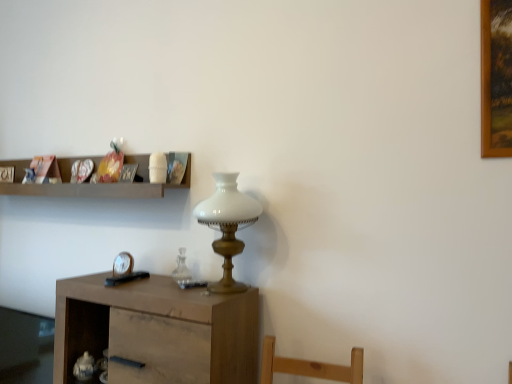
At what (x,y) coordinates should I click in order to perform the action: click on wooden cabinet at center. Please return your answer as a coordinate pair (x, y). Looking at the image, I should click on (157, 330).

Image resolution: width=512 pixels, height=384 pixels. What do you see at coordinates (157, 330) in the screenshot?
I see `wooden cabinet at center` at bounding box center [157, 330].

Measure the distance between point (x=49, y=359) and camera.

Point (x=49, y=359) is 2.03 meters away from camera.

What do you see at coordinates (25, 347) in the screenshot? I see `transparent glass cabinet at lower left` at bounding box center [25, 347].

Where is `wooden shelf at upper center`? wooden shelf at upper center is located at coordinates (91, 184).

The image size is (512, 384). Describe the element at coordinates (181, 269) in the screenshot. I see `clear glass vase at center` at that location.

The width and height of the screenshot is (512, 384). Identify the location of wooden cabinet at center. (157, 330).

From the picture: Measure the distance from clear glass vase at center to wooden picture frame at upper left, which is the 1th picture frame in left-to-right order.

They are 3.62 feet apart.

Does clear glass vase at center appear on the left side of wooden picture frame at upper left, the second picture frame in the front-to-back sequence?

In fact, clear glass vase at center is to the right of wooden picture frame at upper left, the second picture frame in the front-to-back sequence.

Between point (190, 280) and point (4, 180), which one is positioned in front?

The point (190, 280) is closer.

Locate an element on the screen. The height and width of the screenshot is (384, 512). glass vase below the wooden picture frame at upper left, the second picture frame in the front-to-back sequence (from a real-world perspective) is located at coordinates (181, 269).

Would you consider white glass table lamp at center to be distant from wooden picture frame at upper left, the 1th picture frame positioned from the back?

Yes, white glass table lamp at center is far from wooden picture frame at upper left, the 1th picture frame positioned from the back.

Which object is wider, white glass table lamp at center or wooden picture frame at upper left, the 1th picture frame positioned from the back?

Wider between the two is white glass table lamp at center.

Is white glass table lamp at center situated inside wooden picture frame at upper left, the second picture frame in the front-to-back sequence, or outside?

white glass table lamp at center is outside wooden picture frame at upper left, the second picture frame in the front-to-back sequence.

Is clear glass vase at center taller than metallic silver picture frame at upper center, positioned as the first picture frame in front-to-back order?

Correct, clear glass vase at center is much taller as metallic silver picture frame at upper center, positioned as the first picture frame in front-to-back order.

Considering the positions of objects clear glass vase at center and metallic silver picture frame at upper center, positioned as the second picture frame in left-to-right order, in the image provided, who is more to the left, clear glass vase at center or metallic silver picture frame at upper center, positioned as the second picture frame in left-to-right order,?

metallic silver picture frame at upper center, positioned as the second picture frame in left-to-right order.

Is clear glass vase at center facing away from metallic silver picture frame at upper center, which is the 2th picture frame from back to front?

clear glass vase at center does not have its back to metallic silver picture frame at upper center, which is the 2th picture frame from back to front.

From a real-world perspective, between clear glass vase at center and metallic silver picture frame at upper center, positioned as the second picture frame in left-to-right order, who is vertically higher?

metallic silver picture frame at upper center, positioned as the second picture frame in left-to-right order, is physically above.

Is metallic silver clock at lower left aimed at clear glass vase at center?

No, metallic silver clock at lower left is not aimed at clear glass vase at center.

From a real-world perspective, is metallic silver clock at lower left on top of clear glass vase at center?

Actually, metallic silver clock at lower left is physically below clear glass vase at center in the real world.

In terms of size, does metallic silver clock at lower left appear bigger or smaller than clear glass vase at center?

metallic silver clock at lower left is smaller than clear glass vase at center.

Is transparent glass cabinet at lower left inside the boundaries of wooden picture frame at upper left, the second picture frame in the front-to-back sequence, or outside?

transparent glass cabinet at lower left is not enclosed by wooden picture frame at upper left, the second picture frame in the front-to-back sequence.

Is point (16, 359) closer or farther from the camera than point (13, 178)?

Point (16, 359) is positioned closer to the camera compared to point (13, 178).

Which of these two, transparent glass cabinet at lower left or wooden picture frame at upper left, the second picture frame in the front-to-back sequence, is thinner?

wooden picture frame at upper left, the second picture frame in the front-to-back sequence.

Which object is positioned more to the right, transparent glass cabinet at lower left or wooden picture frame at upper left, the second picture frame in the front-to-back sequence?

transparent glass cabinet at lower left.

Is metallic silver picture frame at upper center, positioned as the second picture frame in left-to-right order, smaller than metallic silver clock at lower left?

Incorrect, metallic silver picture frame at upper center, positioned as the second picture frame in left-to-right order, is not smaller in size than metallic silver clock at lower left.

Considering their positions, is metallic silver picture frame at upper center, positioned as the first picture frame in front-to-back order, located in front of or behind metallic silver clock at lower left?

Clearly, metallic silver picture frame at upper center, positioned as the first picture frame in front-to-back order, is in front of metallic silver clock at lower left.

Does metallic silver picture frame at upper center, positioned as the first picture frame in front-to-back order, have a lesser width compared to metallic silver clock at lower left?

In fact, metallic silver picture frame at upper center, positioned as the first picture frame in front-to-back order, might be wider than metallic silver clock at lower left.

From the image's perspective, is transparent glass cabinet at lower left above or below wooden shelf at upper center?

Based on their image positions, transparent glass cabinet at lower left is located beneath wooden shelf at upper center.

Which of these two, transparent glass cabinet at lower left or wooden shelf at upper center, is wider?

With larger width is wooden shelf at upper center.

From a real-world perspective, is transparent glass cabinet at lower left positioned above or below wooden shelf at upper center?

Clearly, from a real-world perspective, transparent glass cabinet at lower left is below wooden shelf at upper center.

What's the angular difference between transparent glass cabinet at lower left and wooden shelf at upper center's facing directions?

There is a 1.83-degree angle between the facing directions of transparent glass cabinet at lower left and wooden shelf at upper center.

I want to click on the 2nd picture frame positioned above the clear glass vase at center (from the image's perspective), so click(x=7, y=174).

Where is `table lamp on the right of wooden picture frame at upper left, which is the 1th picture frame in left-to-right order`? The width and height of the screenshot is (512, 384). table lamp on the right of wooden picture frame at upper left, which is the 1th picture frame in left-to-right order is located at coordinates (227, 225).

Based on their spatial positions, is transparent glass cabinet at lower left or metallic silver clock at lower left closer to metallic silver picture frame at upper center, which appears as the first picture frame when viewed from the right?

Among the two, metallic silver clock at lower left is located nearer to metallic silver picture frame at upper center, which appears as the first picture frame when viewed from the right.

Which object lies further to the anchor point wooden shelf at upper center, metallic silver picture frame at upper center, which appears as the first picture frame when viewed from the right, or metallic silver clock at lower left?

The object further to wooden shelf at upper center is metallic silver clock at lower left.

When comparing their distances from wooden cabinet at center, does metallic silver clock at lower left or metallic silver picture frame at upper center, which is the 2th picture frame from back to front, seem further?

metallic silver picture frame at upper center, which is the 2th picture frame from back to front, is further to wooden cabinet at center.

Which object lies further to the anchor point wooden shelf at upper center, white glass table lamp at center or transparent glass cabinet at lower left?

Answer: transparent glass cabinet at lower left is positioned further to the anchor wooden shelf at upper center.

Estimate the real-world distances between objects in this image. Which object is closer to wooden shelf at upper center, white glass table lamp at center or clear glass vase at center?

The object closer to wooden shelf at upper center is white glass table lamp at center.

In the scene shown: Looking at the image, which one is located further to metallic silver picture frame at upper center, which appears as the first picture frame when viewed from the right, wooden picture frame at upper left, the second picture frame in the front-to-back sequence, or white glass table lamp at center?

wooden picture frame at upper left, the second picture frame in the front-to-back sequence, lies further to metallic silver picture frame at upper center, which appears as the first picture frame when viewed from the right, than the other object.

Considering their positions, is metallic silver picture frame at upper center, which appears as the first picture frame when viewed from the right, positioned further to white glass table lamp at center than clear glass vase at center?

Based on the image, metallic silver picture frame at upper center, which appears as the first picture frame when viewed from the right, appears to be further to white glass table lamp at center.

From the image, which object appears to be nearer to transparent glass cabinet at lower left, wooden picture frame at upper left, which is the 1th picture frame in left-to-right order, or wooden cabinet at center?

Among the two, wooden cabinet at center is located nearer to transparent glass cabinet at lower left.

In order to click on picture frame between wooden shelf at upper center and transparent glass cabinet at lower left in the up-down direction in this screenshot , I will do `click(128, 173)`.

I want to click on clock between transparent glass cabinet at lower left and clear glass vase at center from left to right, so click(123, 264).

Where is `shelf between wooden picture frame at upper left, the second picture frame in the front-to-back sequence, and white glass table lamp at center`? shelf between wooden picture frame at upper left, the second picture frame in the front-to-back sequence, and white glass table lamp at center is located at coordinates (91, 184).

What are the coordinates of `table lamp between wooden cabinet at center and metallic silver clock at lower left in the front-back direction` in the screenshot? It's located at (227, 225).